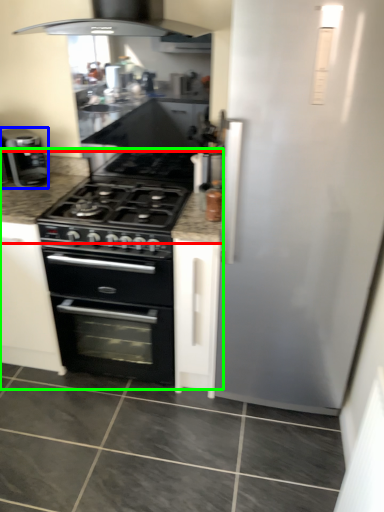
Question: Which object is the farthest from countertop (highlighted by a red box)? Choose among these: kitchen appliance (highlighted by a blue box) or counter (highlighted by a green box).

Choices:
 (A) kitchen appliance
 (B) counter

Answer: (B)